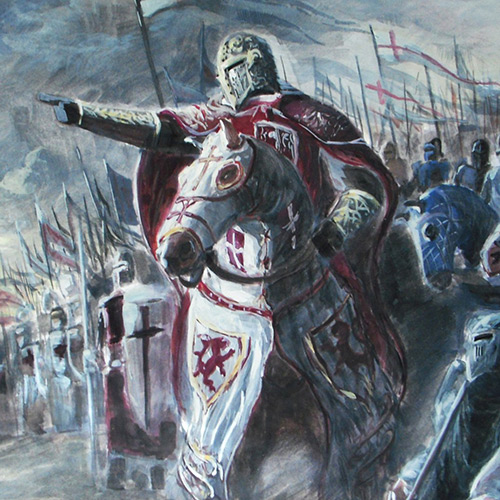
Identify the location of lower right corner of artwork. (1, 496).